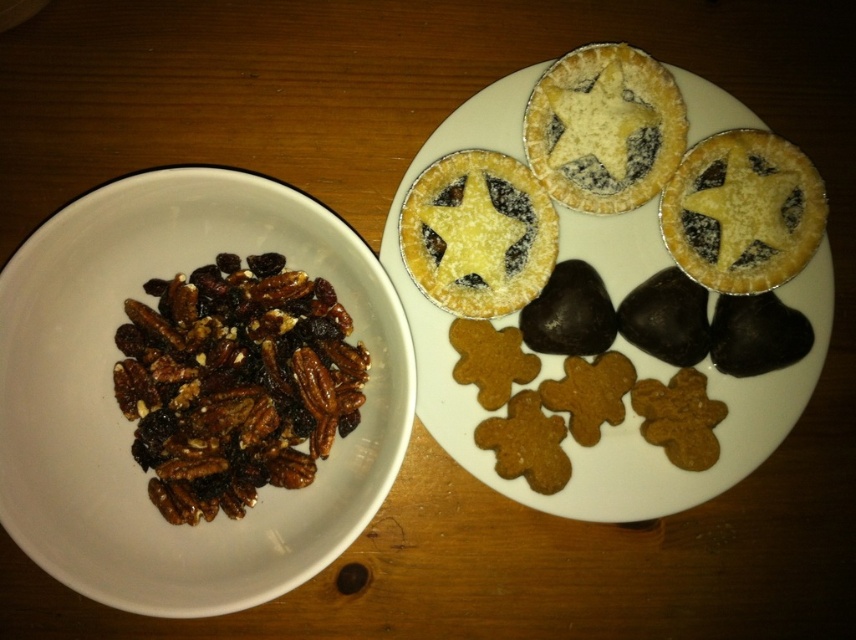
Which is above, matte white plate at upper center or matte golden pie at upper right?

matte golden pie at upper right is higher up.

Can you confirm if matte white plate at upper center is positioned to the right of matte golden pie at upper right?

Incorrect, matte white plate at upper center is not on the right side of matte golden pie at upper right.

Between point (724, 470) and point (752, 189), which one is positioned behind?

Point (724, 470)

The image size is (856, 640). Find the location of `matte white plate at upper center`. matte white plate at upper center is located at coordinates (625, 394).

Is brown crunchy nuts at left positioned at the back of matte golden pie at upper right?

No, it is in front of matte golden pie at upper right.

Who is more distant from viewer, (191,337) or (697,272)?

The point (697,272) is more distant.

Where is `brown crunchy nuts at left`? The height and width of the screenshot is (640, 856). brown crunchy nuts at left is located at coordinates [235, 381].

Describe the element at coordinates (146, 476) in the screenshot. I see `brown matte nuts at left` at that location.

Does brown matte nuts at left have a greater width compared to matte white plate at upper center?

Incorrect, brown matte nuts at left's width does not surpass matte white plate at upper center's.

Between point (337, 449) and point (510, 83), which one is positioned behind?

The point (510, 83) is behind.

The width and height of the screenshot is (856, 640). I want to click on brown matte nuts at left, so click(146, 476).